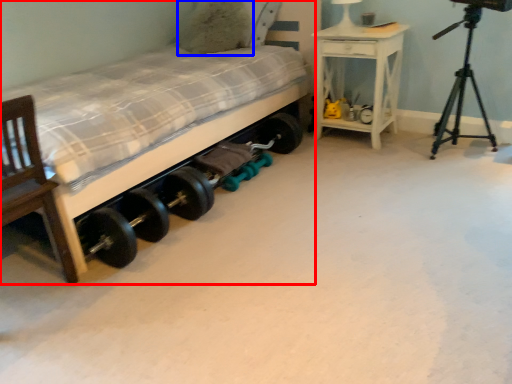
Question: Which object is further to the camera taking this photo, bed (highlighted by a red box) or pillow (highlighted by a blue box)?

Choices:
 (A) bed
 (B) pillow

Answer: (B)